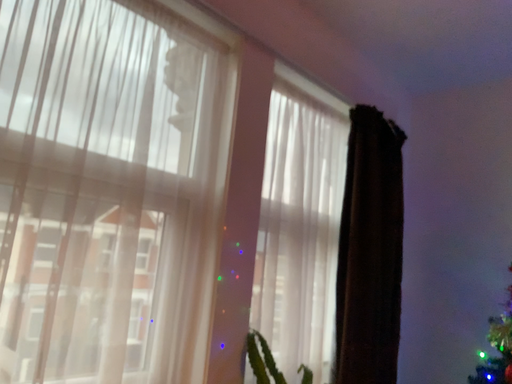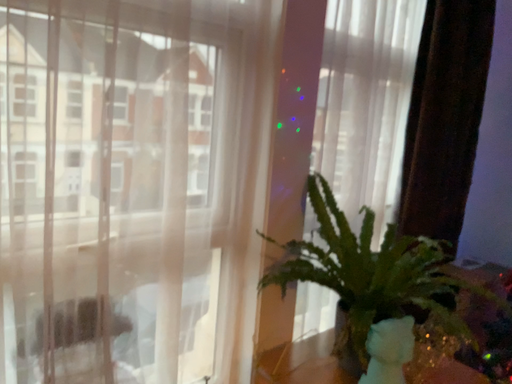
Question: How did the camera likely rotate when shooting the video?

Choices:
 (A) rotated left
 (B) rotated right

Answer: (A)